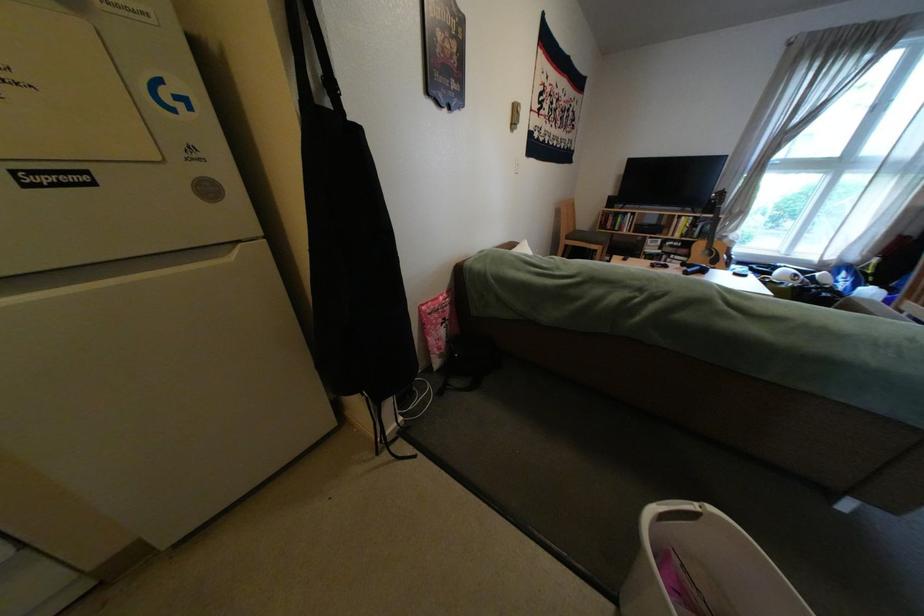
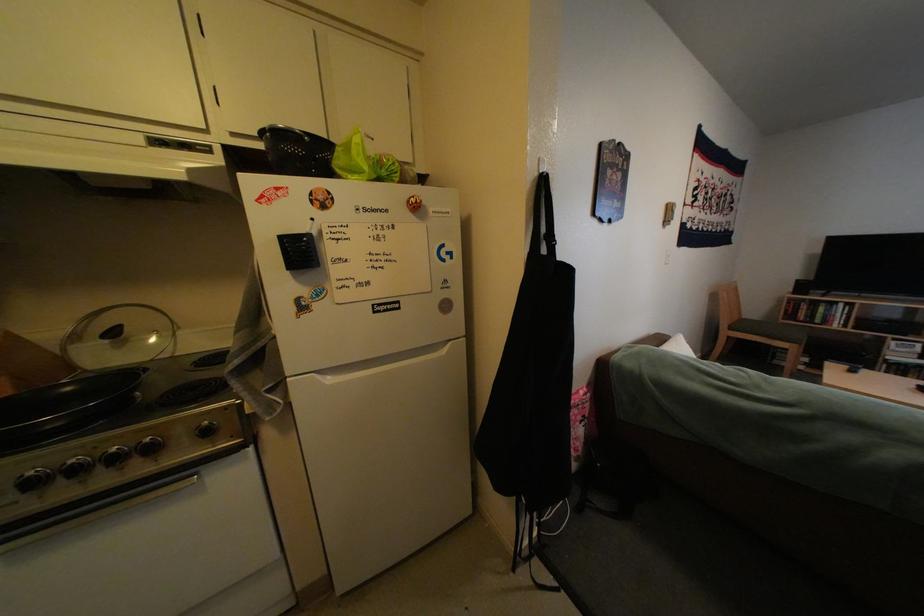
Question: The camera is either moving clockwise (left) or counter-clockwise (right) around the object. The first image is from the beginning of the video and the second image is from the end. Is the camera moving left or right when shooting the video?

Choices:
 (A) Left
 (B) Right

Answer: (B)